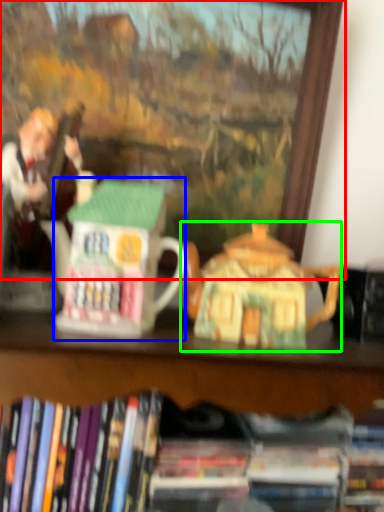
Question: Considering the real-world distances, which object is farthest from picture frame (highlighted by a red box)? toy (highlighted by a blue box) or teapot (highlighted by a green box)?

Choices:
 (A) toy
 (B) teapot

Answer: (A)